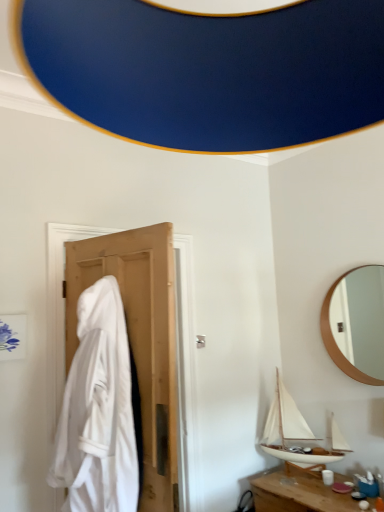
Question: Does point (321, 480) appear closer or farther from the camera than point (261, 441)?

Choices:
 (A) closer
 (B) farther

Answer: (A)

Question: Would you say wooden table at lower right is inside or outside white wood boat at lower right?

Choices:
 (A) inside
 (B) outside

Answer: (B)

Question: Considering the real-world distances, which object is farthest from the white wood boat at lower right?

Choices:
 (A) wooden round mirror at upper right
 (B) wooden table at lower right
 (C) white fabric at left

Answer: (C)

Question: Based on their relative distances, which object is farther from the wooden table at lower right?

Choices:
 (A) wooden round mirror at upper right
 (B) white wood boat at lower right
 (C) white fabric at left

Answer: (A)